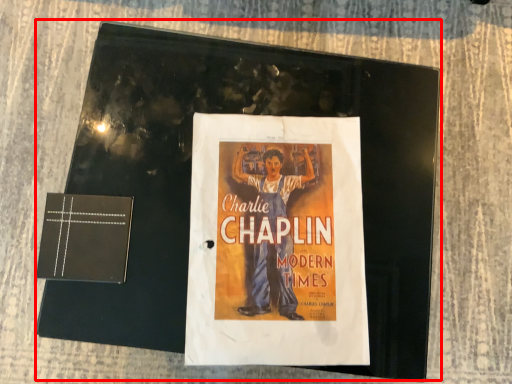
Question: Where is magazine (annotated by the red box) located in relation to paperback book in the image?

Choices:
 (A) left
 (B) right

Answer: (B)